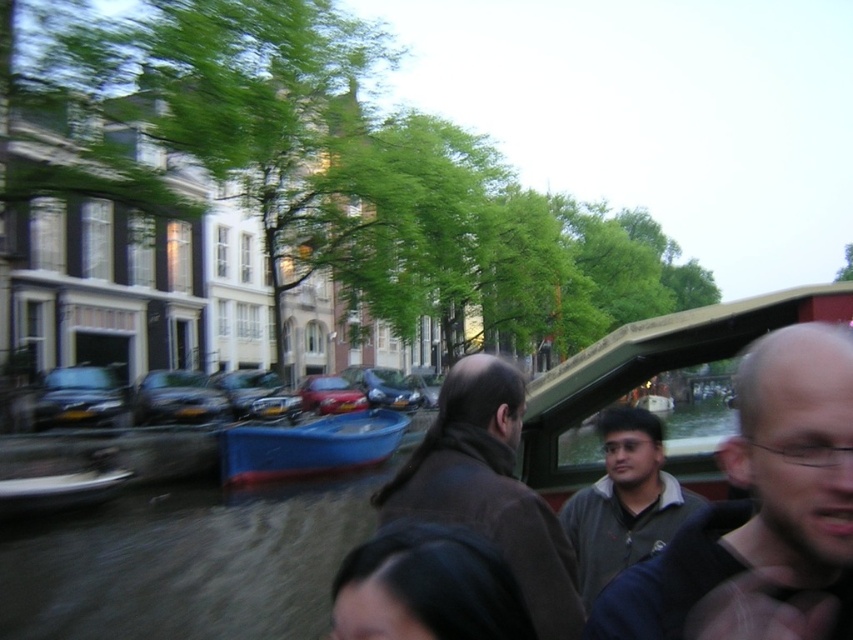
Question: Is the position of black hair at lower center less distant than that of blue plastic boat at lower left?

Choices:
 (A) yes
 (B) no

Answer: (A)

Question: Considering the real-world distances, which object is farthest from the dark gray water at center?

Choices:
 (A) gray fleece jacket at center
 (B) blue plastic boat at lower left
 (C) dark gray sweater at center

Answer: (C)

Question: Is blue plastic boat at center positioned behind blue plastic boat at lower left?

Choices:
 (A) yes
 (B) no

Answer: (A)

Question: Which point appears farthest from the camera in this image?

Choices:
 (A) (260, 460)
 (B) (595, 497)
 (C) (497, 608)
 (D) (672, 637)

Answer: (A)

Question: Which object appears farthest from the camera in this image?

Choices:
 (A) dark gray sweater at center
 (B) blue plastic boat at lower left

Answer: (B)

Question: Does brown wool coat at center have a lesser width compared to gray fleece jacket at center?

Choices:
 (A) yes
 (B) no

Answer: (B)